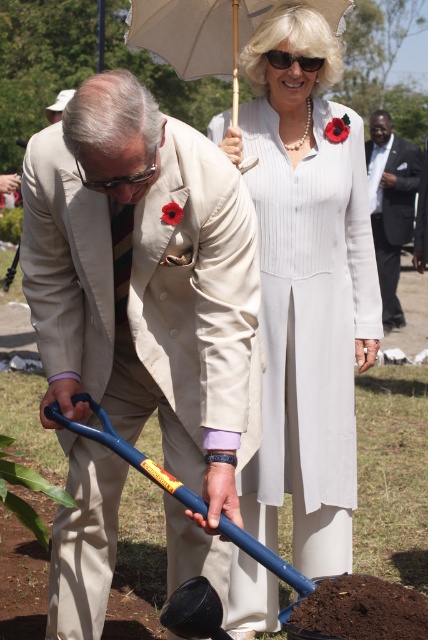
Which of these two, matte beige suit at center or white fabric umbrella at upper center, stands taller?

matte beige suit at center is taller.

Is matte beige suit at center to the right of white fabric umbrella at upper center from the viewer's perspective?

No, matte beige suit at center is not to the right of white fabric umbrella at upper center.

Is point (234, 268) positioned behind point (253, 22)?

No.

Locate an element on the screen. matte beige suit at center is located at coordinates (140, 326).

Describe the element at coordinates (391, 204) in the screenshot. This screenshot has width=428, height=640. I see `black satin suit at upper right` at that location.

Is point (380, 204) in front of point (181, 586)?

No, (380, 204) is further to viewer.

Image resolution: width=428 pixels, height=640 pixels. What do you see at coordinates (391, 204) in the screenshot?
I see `black satin suit at upper right` at bounding box center [391, 204].

Where is `black satin suit at upper right`? The height and width of the screenshot is (640, 428). black satin suit at upper right is located at coordinates (391, 204).

Is white fabric umbrella at upper center positioned behind matte black goggles at left?

Yes, it is.

Describe the element at coordinates (210, 33) in the screenshot. I see `white fabric umbrella at upper center` at that location.

Identify the location of white fabric umbrella at upper center. (210, 33).